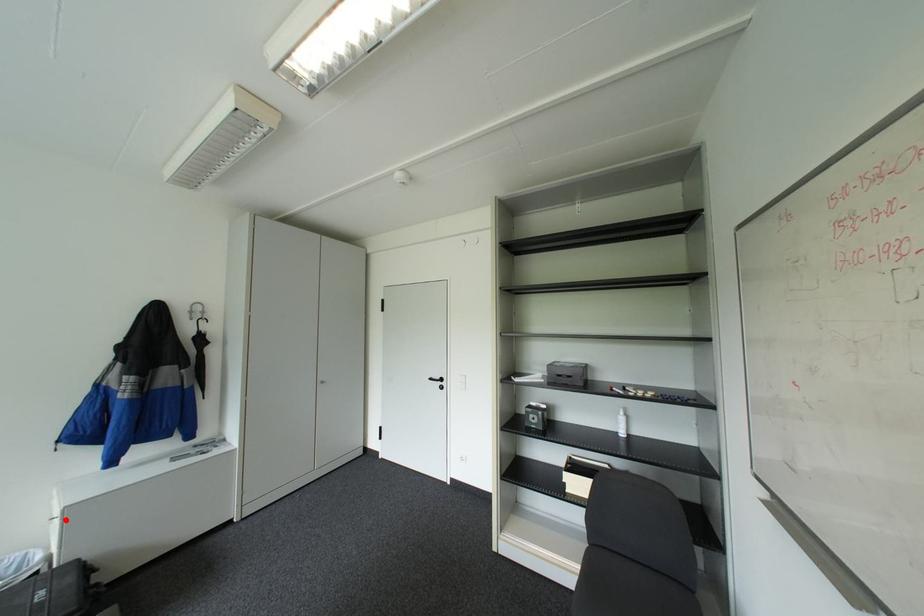
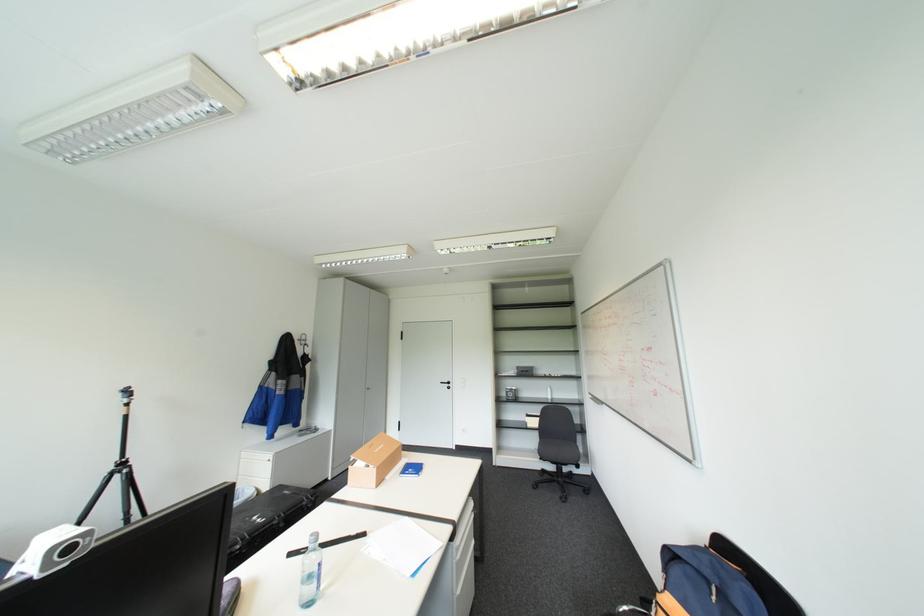
Question: I am providing you with two images of the same scene from different viewpoints. A red point is shown in image1. For the corresponding object point in image2, is it positioned nearer or farther from the camera?

Choices:
 (A) Nearer
 (B) Farther

Answer: (B)